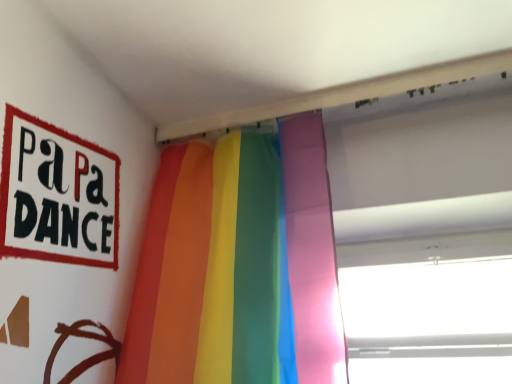
Question: Is rainbow fabric curtain at center in front of or behind transparent plastic window at upper right in the image?

Choices:
 (A) front
 (B) behind

Answer: (A)

Question: Does point click(248, 238) appear closer or farther from the camera than point click(376, 296)?

Choices:
 (A) farther
 (B) closer

Answer: (B)

Question: From the image's perspective, is rainbow fabric curtain at center located above or below transparent plastic window at upper right?

Choices:
 (A) below
 (B) above

Answer: (B)

Question: Looking at their shapes, would you say transparent plastic window at upper right is wider or thinner than rainbow fabric curtain at center?

Choices:
 (A) thin
 (B) wide

Answer: (B)

Question: Is transparent plastic window at upper right spatially inside rainbow fabric curtain at center, or outside of it?

Choices:
 (A) outside
 (B) inside

Answer: (A)

Question: From the image's perspective, is transparent plastic window at upper right above or below rainbow fabric curtain at center?

Choices:
 (A) below
 (B) above

Answer: (A)

Question: Visually, is transparent plastic window at upper right positioned to the left or to the right of rainbow fabric curtain at center?

Choices:
 (A) right
 (B) left

Answer: (A)